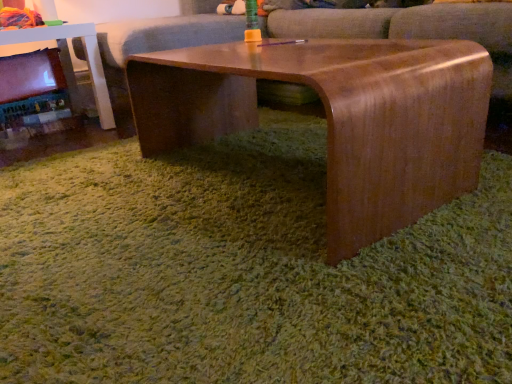
The image size is (512, 384). I want to click on blank space to the left of satin wood coffee table at center, so click(98, 195).